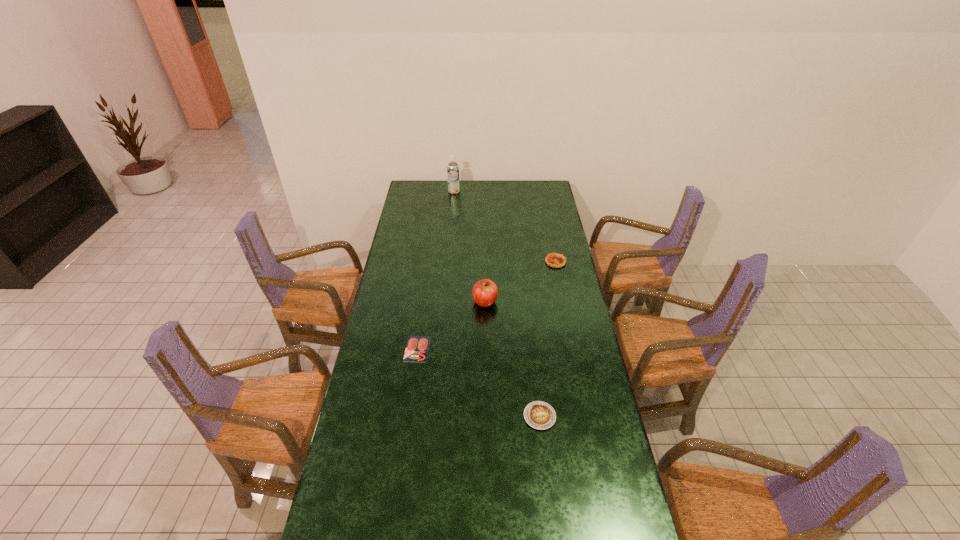
Where is `blank space located on the label of the second object from left to right`? blank space located on the label of the second object from left to right is located at coordinates (452, 214).

In order to click on vacant space located 0.260m on the front of the fourth shortest object in this screenshot , I will do `click(486, 360)`.

This screenshot has height=540, width=960. In order to click on vacant region located on the front of the right quiche in this screenshot , I will do `click(559, 277)`.

Identify the location of vacant space located 0.120m on the left of the second object from right to left. The width and height of the screenshot is (960, 540). (489, 416).

Where is `vacant space located 0.380m on the back of the fourth farthest object`? This screenshot has height=540, width=960. vacant space located 0.380m on the back of the fourth farthest object is located at coordinates (427, 274).

Locate an element on the screen. The width and height of the screenshot is (960, 540). object that is at the far edge is located at coordinates (453, 176).

At what (x,y) coordinates should I click in order to perform the action: click on object present at the left edge. Please return your answer as a coordinate pair (x, y). This screenshot has width=960, height=540. Looking at the image, I should click on (417, 347).

You are a GUI agent. You are given a task and a screenshot of the screen. Output one action in this format:
    pyautogui.click(x=<x>, y=<y>)
    Task: Click on the object located in the right edge section of the desktop
    
    Given the screenshot: What is the action you would take?
    pyautogui.click(x=555, y=260)

In the image, there is a desktop. Find the location of `blank space at the far edge`. blank space at the far edge is located at coordinates (482, 184).

You are a GUI agent. You are given a task and a screenshot of the screen. Output one action in this format:
    pyautogui.click(x=<x>, y=<y>)
    Task: Click on the vacant region at the left edge of the desktop
    
    Given the screenshot: What is the action you would take?
    pyautogui.click(x=388, y=429)